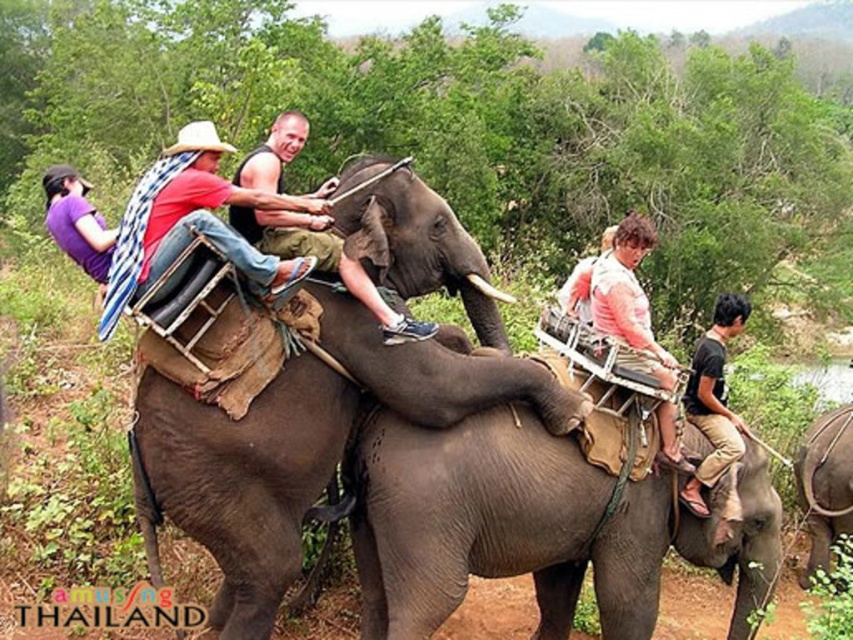
Who is taller, gray matte elephant at center or matte black tank top at center?

Standing taller between the two is gray matte elephant at center.

The width and height of the screenshot is (853, 640). I want to click on gray matte elephant at center, so click(537, 524).

Is point (698, 556) farther from camera compared to point (244, 248)?

Yes, point (698, 556) is behind point (244, 248).

Locate an element on the screen. Image resolution: width=853 pixels, height=640 pixels. gray matte elephant at center is located at coordinates (537, 524).

Who is taller, gray textured elephant at center or purple fabric at upper left?

With more height is gray textured elephant at center.

What do you see at coordinates (325, 404) in the screenshot?
I see `gray textured elephant at center` at bounding box center [325, 404].

Who is more forward, (244, 508) or (74, 202)?

Positioned in front is point (244, 508).

Image resolution: width=853 pixels, height=640 pixels. I want to click on gray textured elephant at center, so click(325, 404).

What do you see at coordinates (196, 220) in the screenshot? The image size is (853, 640). I see `matte black tank top at center` at bounding box center [196, 220].

Identify the location of matte black tank top at center. (196, 220).